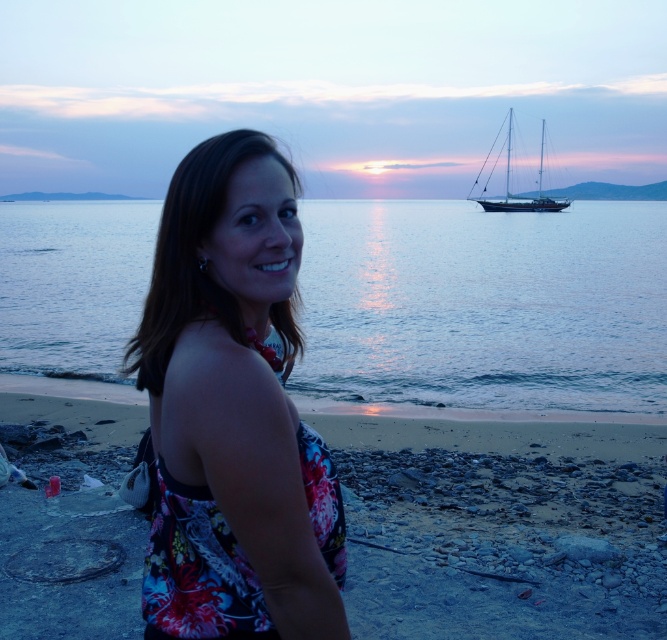
You are a photographer trying to capture the sunset scene. You notice the blue water at center and the dark blue polished wood sailboat at upper right. Which object is positioned higher in the image?

The dark blue polished wood sailboat at upper right is positioned higher in the image than the blue water at center, as the water is located below the sailboat.

You are standing at the point marked by the coordinates point (484, 305). Looking towards the direction where the woman is facing, what is the first object you would encounter?

The first object you would encounter is the blue water at center marked by the point (484, 305).